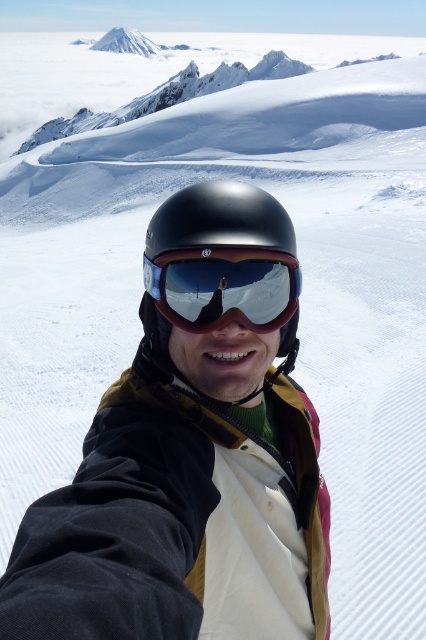
You are a photographer trying to capture the snowy landscape behind the person. Since the glossy reflective goggles at center and the matte black helmet at center are blocking your view, which object should you move to get a clearer shot of the landscape?

The glossy reflective goggles at center is behind the matte black helmet at center, so you should move the matte black helmet at center to get a clearer shot of the landscape.

You are a photographer trying to capture the reflection of the snowy mountains in the glossy reflective goggles at center. Since the matte black helmet at center is in the way, can you adjust your angle to see the reflection without the helmet blocking it?

The matte black helmet at center is below the glossy reflective goggles at center. By tilting your camera upwards to focus on the upper part of the goggles, you can avoid the helmet and capture the reflection of the snowy mountains.